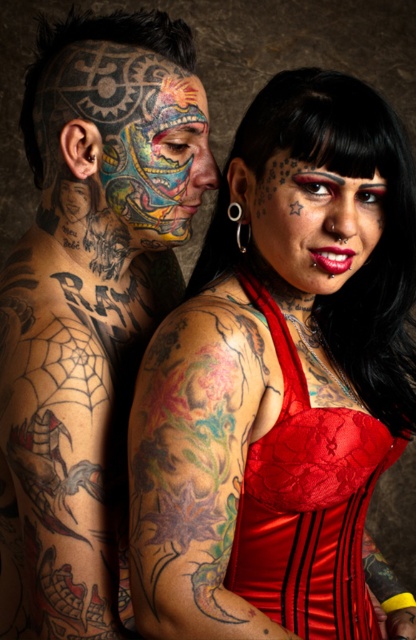
Can you confirm if red satin dress at center is thinner than colorful tattooed face at center?

In fact, red satin dress at center might be wider than colorful tattooed face at center.

Locate an element on the screen. The height and width of the screenshot is (640, 416). red satin dress at center is located at coordinates (309, 506).

Based on the photo, does matte red lace dress at center appear over multicolored tattooed face at center?

Actually, matte red lace dress at center is below multicolored tattooed face at center.

Between point (161, 433) and point (111, 531), which one is positioned in front?

Point (161, 433) is more forward.

Identify the location of matte red lace dress at center. (279, 378).

Which is below, multicolored tattooed face at center or red satin dress at center?

red satin dress at center is lower down.

Can you confirm if multicolored tattooed face at center is wider than red satin dress at center?

Yes.

Does point (56, 120) come farther from viewer compared to point (255, 496)?

No, (56, 120) is in front of (255, 496).

Where is `multicolored tattooed face at center`? The width and height of the screenshot is (416, 640). multicolored tattooed face at center is located at coordinates (89, 305).